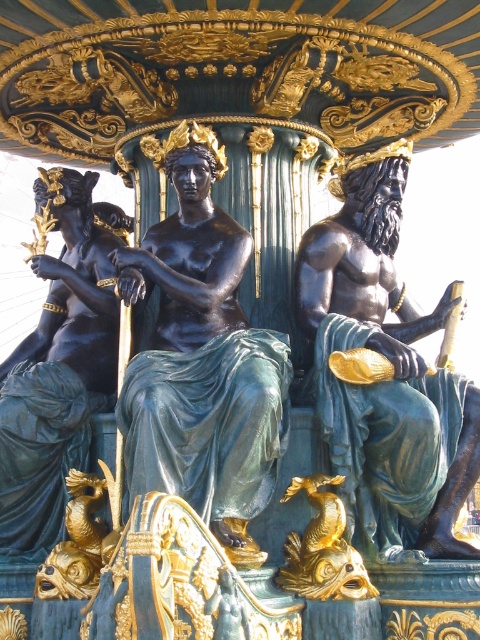
Looking at this image, you are an art student analyzing the fountain sculpture. You notice two bronze statues in the scene. Which one is shorter between the bronze statue at center and the bronze statue at left?

The bronze statue at center is shorter than the bronze statue at left.

Looking at the fountain sculpture, you see the black polished stone man at center and the bronze statue at left. Which one is positioned to the right of the other?

The black polished stone man at center is positioned to the right of the bronze statue at left.